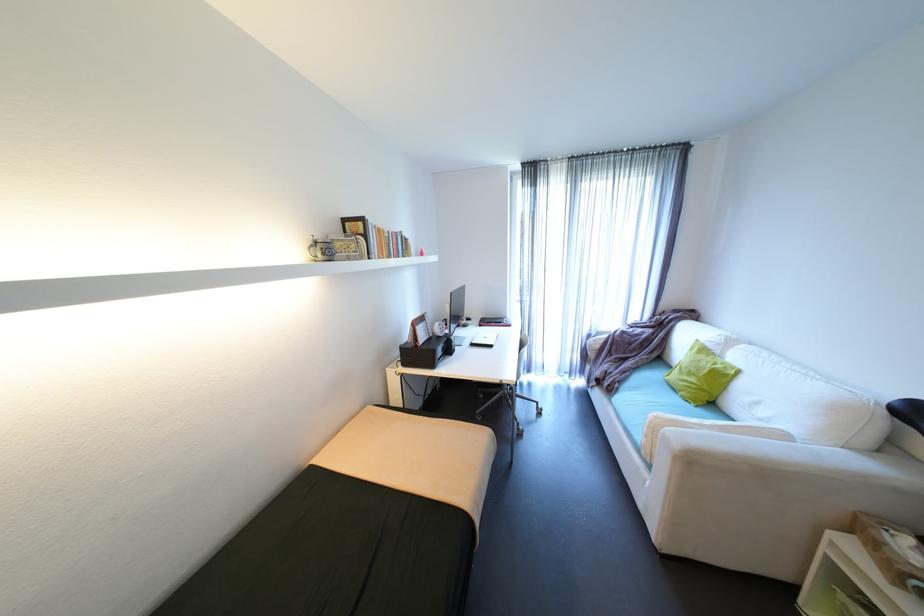
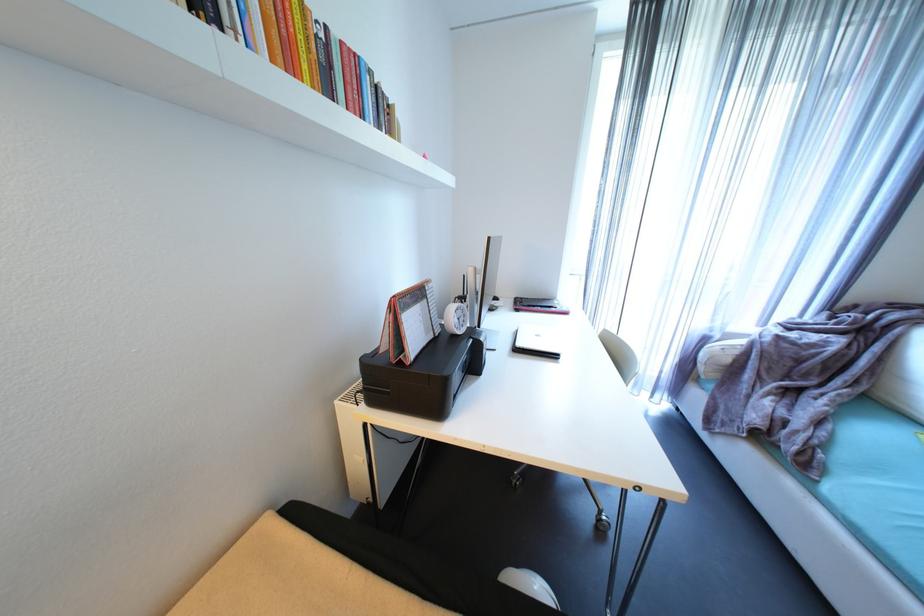
Question: In a continuous first-person perspective shot, in which direction is the camera moving?

Choices:
 (A) Left
 (B) Right
 (C) Forward
 (D) Backward

Answer: (C)